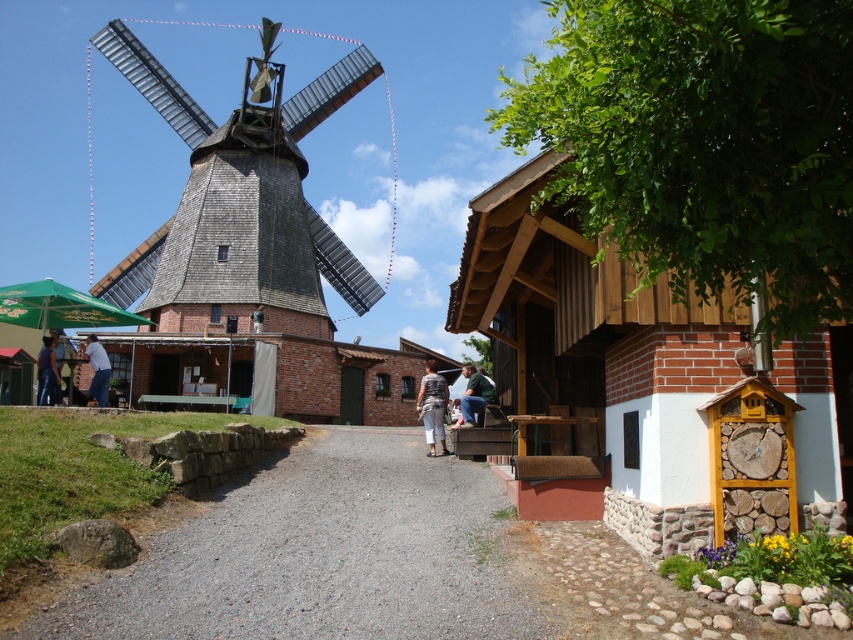
You are standing at the entrance of the rural scene and want to reach the wooden shingles windmill at left. Which direction should you walk to avoid the gray gravel path at center?

You should walk to the left side to avoid the gray gravel path at center, as the path is in front of the wooden shingles windmill at left and walking left would bypass it.

You are standing in the rural scene and want to walk from the wooden shingles windmill at left to the green fabric jacket at center. Which direction should you move to get closer to the jacket?

You should move towards the center of the scene because the green fabric jacket at center is closer to you than the wooden shingles windmill at left, so moving toward the center will bring you nearer to the jacket.